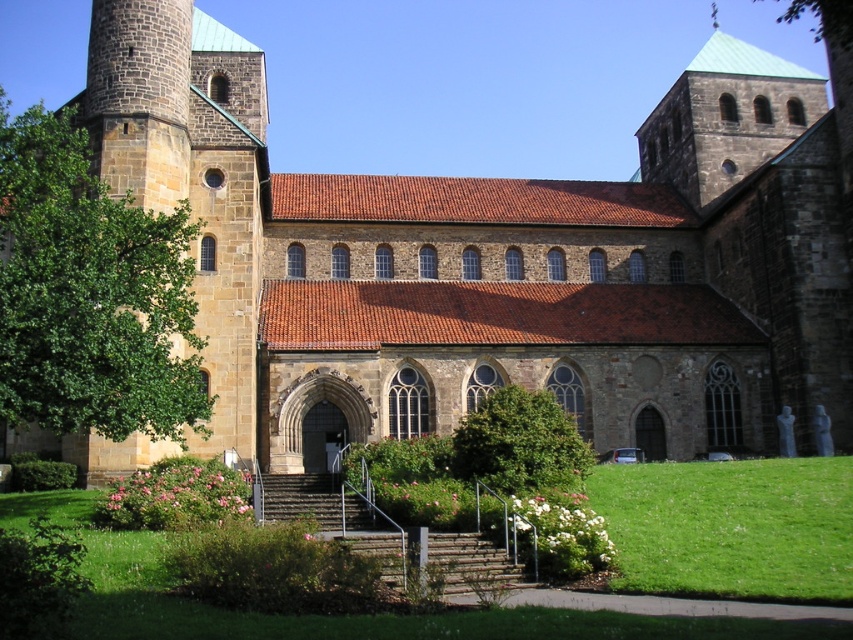
Does green leafy tree at left appear over green leafy bush at center?

Yes, green leafy tree at left is above green leafy bush at center.

Can you confirm if green leafy tree at left is taller than green leafy bush at center?

Yes.

This screenshot has width=853, height=640. In order to click on green leafy tree at left in this screenshot , I will do `click(90, 294)`.

I want to click on green leafy tree at left, so click(x=90, y=294).

Who is positioned more to the left, green leafy tree at left or brown stone stairs at center?

From the viewer's perspective, green leafy tree at left appears more on the left side.

Can you confirm if green leafy tree at left is taller than brown stone stairs at center?

Correct, green leafy tree at left is much taller as brown stone stairs at center.

This screenshot has width=853, height=640. In order to click on green leafy tree at left in this screenshot , I will do `click(90, 294)`.

This screenshot has height=640, width=853. Find the location of `green leafy tree at left`. green leafy tree at left is located at coordinates (90, 294).

Does green leafy bush at center lie behind brown stone stairs at center?

Yes, it is behind brown stone stairs at center.

Who is positioned more to the right, green leafy bush at center or brown stone stairs at center?

From the viewer's perspective, green leafy bush at center appears more on the right side.

Who is more forward, (490, 484) or (465, 593)?

Point (465, 593)

Find the location of a particular element. Image resolution: width=853 pixels, height=640 pixels. green leafy bush at center is located at coordinates (520, 444).